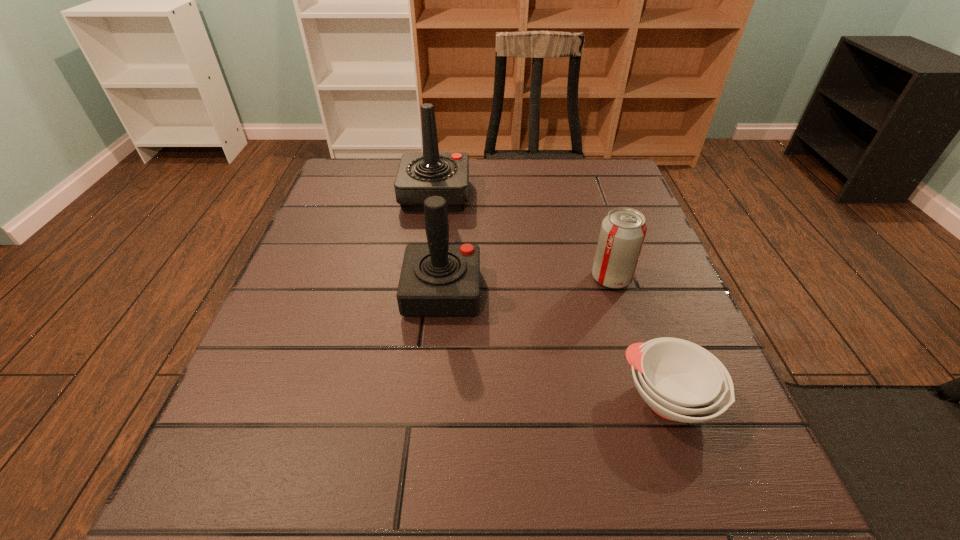
In order to click on the farthest object in this screenshot , I will do `click(420, 175)`.

The image size is (960, 540). Identify the location of the nearer joystick. (438, 279).

Identify the location of the second shortest object. (623, 230).

Locate an element on the screen. This screenshot has height=540, width=960. the shortest object is located at coordinates (681, 381).

Identify the location of soup bowl. Image resolution: width=960 pixels, height=540 pixels. (681, 381).

Identify the location of free location located 0.340m on the front-facing side of the farther joystick. The image size is (960, 540). (601, 195).

Where is `vacant space located 0.250m on the base of the nearer joystick`? This screenshot has height=540, width=960. vacant space located 0.250m on the base of the nearer joystick is located at coordinates (606, 292).

Locate an element on the screen. Image resolution: width=960 pixels, height=540 pixels. free region located on the left of the second shortest object is located at coordinates (430, 278).

The image size is (960, 540). I want to click on vacant space located on the left of the nearest object, so click(586, 399).

Locate an element on the screen. object located at the far edge is located at coordinates (420, 175).